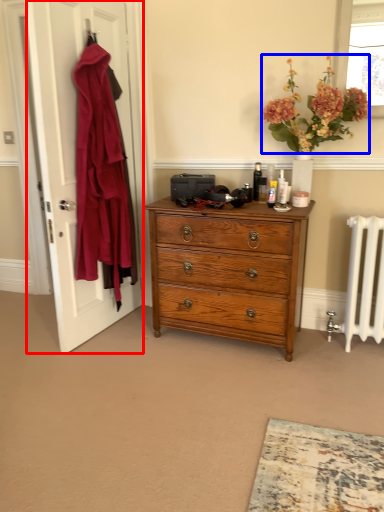
Question: Among these objects, which one is farthest to the camera, door (highlighted by a red box) or flower (highlighted by a blue box)?

Choices:
 (A) door
 (B) flower

Answer: (A)